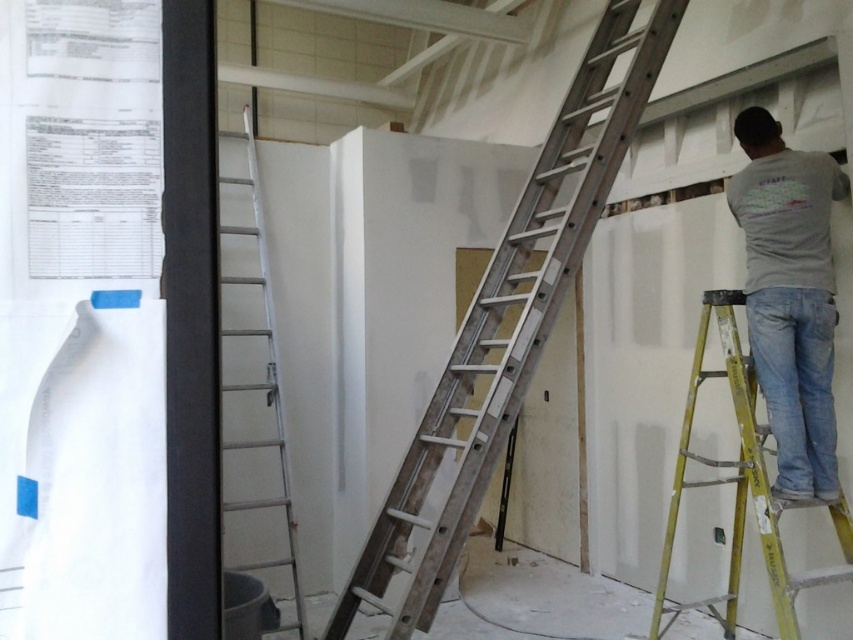
In the scene shown: You are a worker at the construction site and need to access the gray cotton shirt at upper right. Can you reach it without moving the metallic silver ladder at center?

The metallic silver ladder at center is in front of the gray cotton shirt at upper right, so you cannot reach the gray cotton shirt at upper right without moving the ladder first.